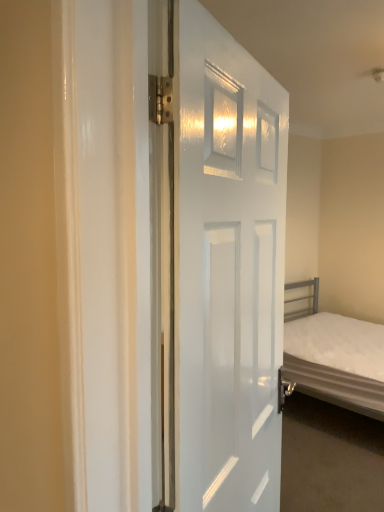
Question: Is white fabric bed at right inside the boundaries of white glossy door at center, or outside?

Choices:
 (A) inside
 (B) outside

Answer: (B)

Question: Considering the positions of white fabric bed at right and white glossy door at center in the image, is white fabric bed at right taller or shorter than white glossy door at center?

Choices:
 (A) tall
 (B) short

Answer: (B)

Question: Relative to white glossy door at center, is white fabric bed at right in front or behind?

Choices:
 (A) behind
 (B) front

Answer: (A)

Question: Is white glossy door at center in front of or behind white fabric bed at right in the image?

Choices:
 (A) front
 (B) behind

Answer: (A)

Question: Is white glossy door at center inside or outside of white fabric bed at right?

Choices:
 (A) inside
 (B) outside

Answer: (B)

Question: From a real-world perspective, is white glossy door at center positioned above or below white fabric bed at right?

Choices:
 (A) below
 (B) above

Answer: (B)

Question: From their relative heights in the image, would you say white glossy door at center is taller or shorter than white fabric bed at right?

Choices:
 (A) short
 (B) tall

Answer: (B)